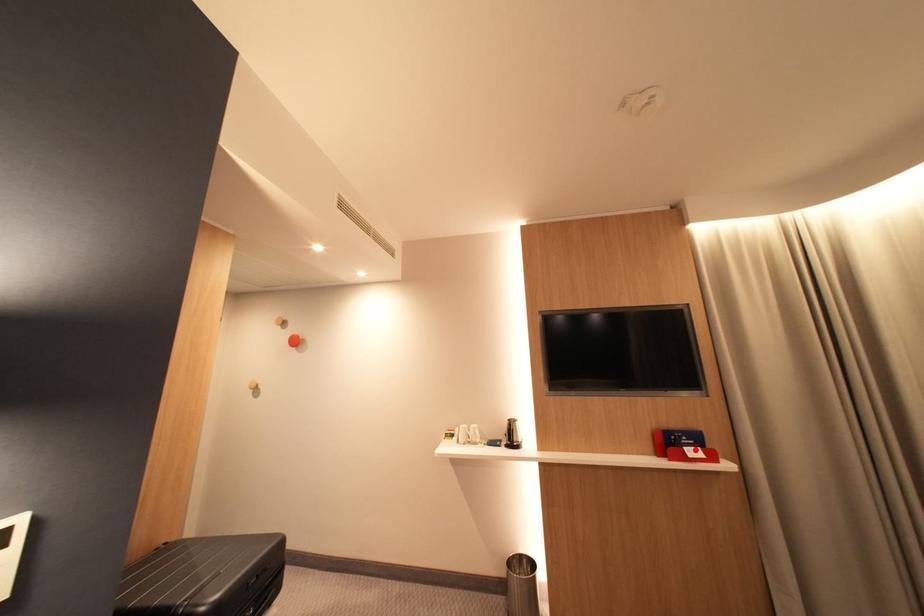
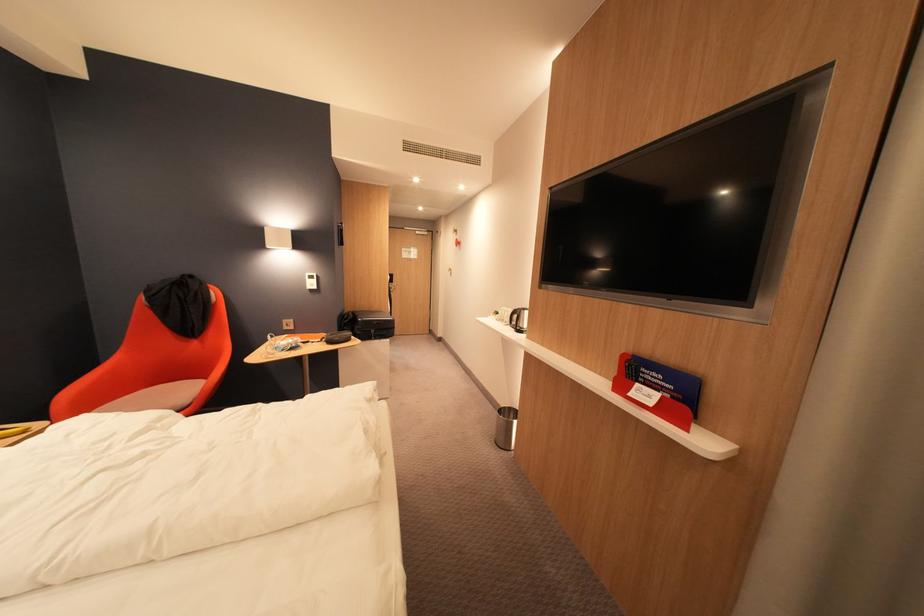
Find the pixel in the second image that matches the highlighted location in the first image.

(648, 386)